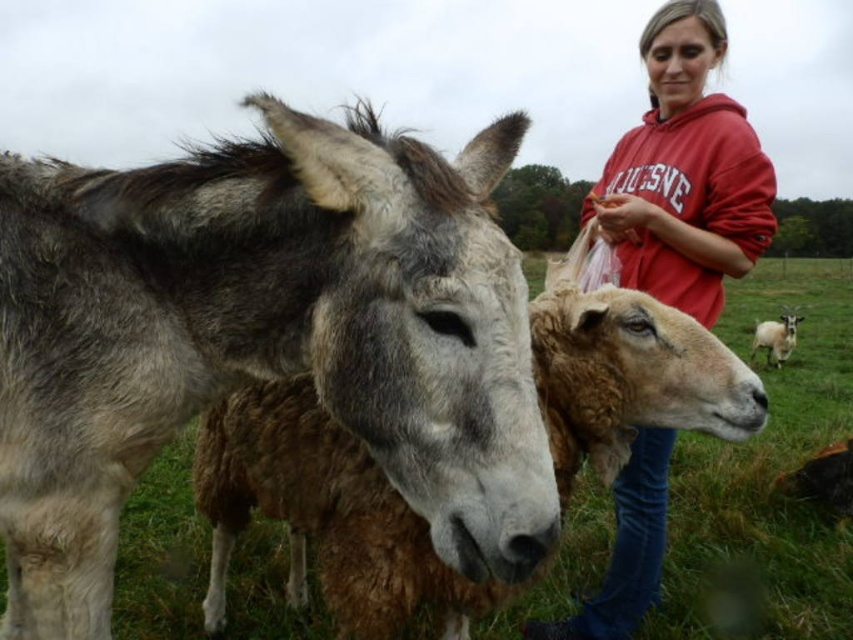
Which of these two, red cotton hoodie at upper right or brown woolen sheep at right, stands shorter?

brown woolen sheep at right is shorter.

Who is more forward, (583, 634) or (759, 348)?

Point (583, 634) is more forward.

Who is more forward, (691, 138) or (753, 344)?

Point (691, 138) is more forward.

Find the location of a particular element. red cotton hoodie at upper right is located at coordinates (685, 172).

Is gray fuzzy donkey at left wider than brown woolen sheep at center?

Incorrect, gray fuzzy donkey at left's width does not surpass brown woolen sheep at center's.

What do you see at coordinates (262, 339) in the screenshot? The width and height of the screenshot is (853, 640). I see `gray fuzzy donkey at left` at bounding box center [262, 339].

Where is `gray fuzzy donkey at left`? The width and height of the screenshot is (853, 640). gray fuzzy donkey at left is located at coordinates (262, 339).

From the picture: Is the position of brown woolen sheep at center less distant than that of red cotton hoodie at upper right?

Yes.

Can you confirm if brown woolen sheep at center is smaller than red cotton hoodie at upper right?

No.

Between point (624, 403) and point (735, 154), which one is positioned behind?

Positioned behind is point (735, 154).

Where is `brown woolen sheep at center`? This screenshot has width=853, height=640. brown woolen sheep at center is located at coordinates (322, 515).